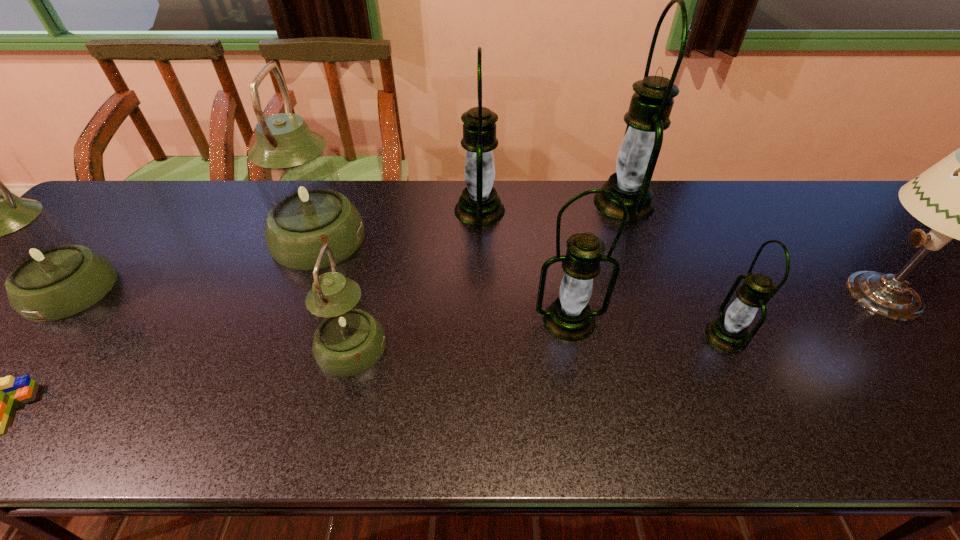
Locate an element on the screen. Image resolution: width=960 pixels, height=540 pixels. free location located 0.370m on the side where the smallest green lantern emits light is located at coordinates (540, 336).

Where is `free point located on the side where the smallest green lantern emits light`? The image size is (960, 540). free point located on the side where the smallest green lantern emits light is located at coordinates (593, 336).

The height and width of the screenshot is (540, 960). In order to click on vacant space located 0.370m on the right of the smallest greenish lantern in this screenshot , I will do `click(556, 347)`.

Find the location of a particular element. Image resolution: width=960 pixels, height=540 pixels. object present at the right edge is located at coordinates (959, 197).

The image size is (960, 540). In the image, there is a desktop. What are the coordinates of `free space at the far edge` in the screenshot? It's located at (704, 194).

The width and height of the screenshot is (960, 540). Identify the location of free space at the near edge. (65, 416).

Image resolution: width=960 pixels, height=540 pixels. In order to click on free space at the left edge of the desktop in this screenshot , I will do `click(50, 332)`.

At what (x,y) coordinates should I click in order to perform the action: click on vacant space at the far left corner of the desktop. Please return your answer as a coordinate pair (x, y). Image resolution: width=960 pixels, height=540 pixels. Looking at the image, I should click on (119, 201).

What are the coordinates of `vacant area at the far right corner of the desktop` in the screenshot? It's located at (830, 208).

The height and width of the screenshot is (540, 960). In order to click on vacant space that is in between the leftmost green lantern and the smallest greenish lantern in this screenshot , I will do `click(416, 279)`.